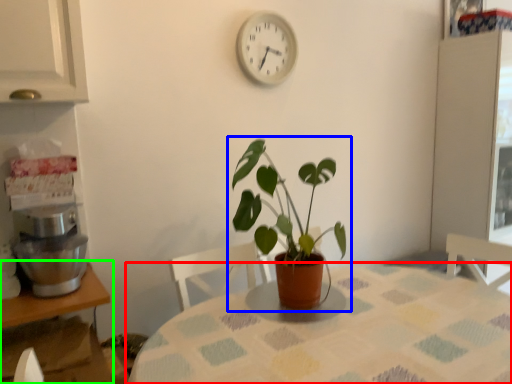
Question: Which is farther away from table (highlighted by a red box)? houseplant (highlighted by a blue box) or table (highlighted by a green box)?

Choices:
 (A) houseplant
 (B) table

Answer: (B)